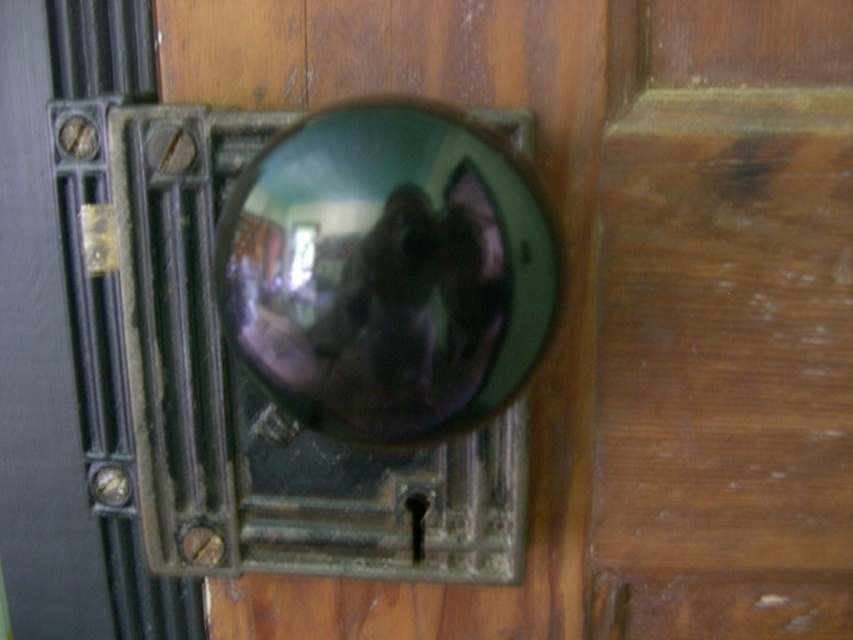
Who is shorter, shiny green knob at center or glossy metallic sphere at center?

glossy metallic sphere at center

Is shiny green knob at center positioned in front of glossy metallic sphere at center?

That is False.

Where is `shiny green knob at center`? shiny green knob at center is located at coordinates (270, 404).

The image size is (853, 640). Find the location of `shiny green knob at center`. shiny green knob at center is located at coordinates (270, 404).